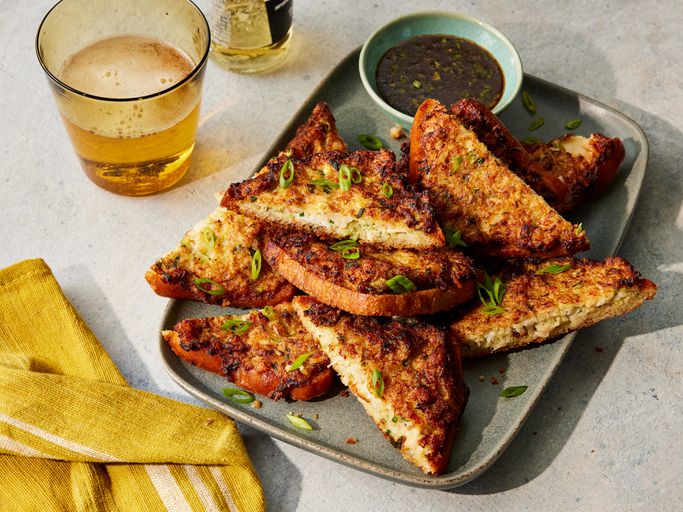
Locate an element on the screen. This screenshot has width=683, height=512. bottle of beverage is located at coordinates (253, 34).